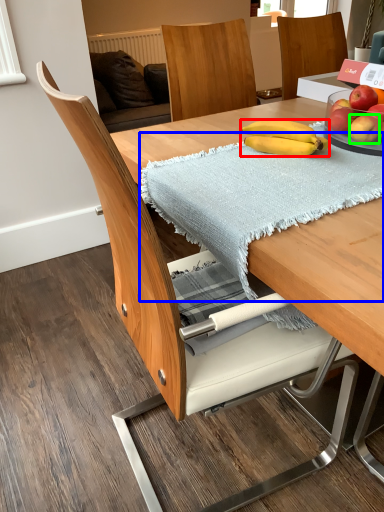
Question: Estimate the real-world distances between objects in this image. Which object is closer to banana (highlighted by a red box), blanket (highlighted by a blue box) or apple (highlighted by a green box)?

Choices:
 (A) blanket
 (B) apple

Answer: (B)